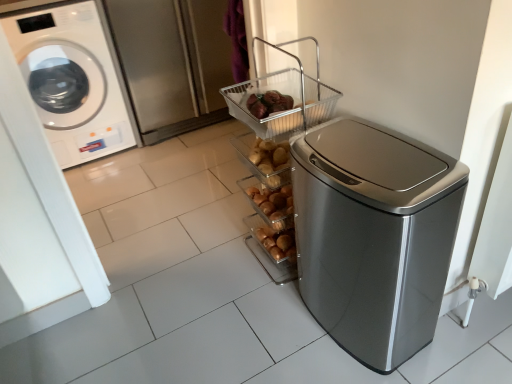
Question: Is white glossy washing machine at left oriented away from brushed metal screen door at upper left?

Choices:
 (A) yes
 (B) no

Answer: (B)

Question: Is brushed metal screen door at upper left inside white glossy washing machine at left?

Choices:
 (A) yes
 (B) no

Answer: (B)

Question: From a real-world perspective, is white glossy washing machine at left positioned under brushed metal screen door at upper left based on gravity?

Choices:
 (A) no
 (B) yes

Answer: (A)

Question: Can you confirm if white glossy washing machine at left is wider than brushed metal screen door at upper left?

Choices:
 (A) yes
 (B) no

Answer: (A)

Question: From the image's perspective, is white glossy washing machine at left on top of brushed metal screen door at upper left?

Choices:
 (A) yes
 (B) no

Answer: (B)

Question: Is white glossy washing machine at left at the right side of brushed metal screen door at upper left?

Choices:
 (A) no
 (B) yes

Answer: (A)

Question: Is the surface of brushed metal screen door at upper left in direct contact with metallic wire basket at upper center?

Choices:
 (A) yes
 (B) no

Answer: (B)

Question: Is brushed metal screen door at upper left not within metallic wire basket at upper center?

Choices:
 (A) no
 (B) yes

Answer: (B)

Question: Can you confirm if brushed metal screen door at upper left is positioned to the left of metallic wire basket at upper center?

Choices:
 (A) no
 (B) yes

Answer: (B)

Question: Considering the relative positions of brushed metal screen door at upper left and metallic wire basket at upper center in the image provided, is brushed metal screen door at upper left to the right of metallic wire basket at upper center from the viewer's perspective?

Choices:
 (A) no
 (B) yes

Answer: (A)

Question: Considering the relative sizes of brushed metal screen door at upper left and metallic wire basket at upper center in the image provided, is brushed metal screen door at upper left thinner than metallic wire basket at upper center?

Choices:
 (A) yes
 (B) no

Answer: (B)

Question: Considering the relative sizes of brushed metal screen door at upper left and metallic wire basket at upper center in the image provided, is brushed metal screen door at upper left taller than metallic wire basket at upper center?

Choices:
 (A) no
 (B) yes

Answer: (B)

Question: Would you say satin silver trash can at right is outside brushed metal screen door at upper left?

Choices:
 (A) yes
 (B) no

Answer: (A)